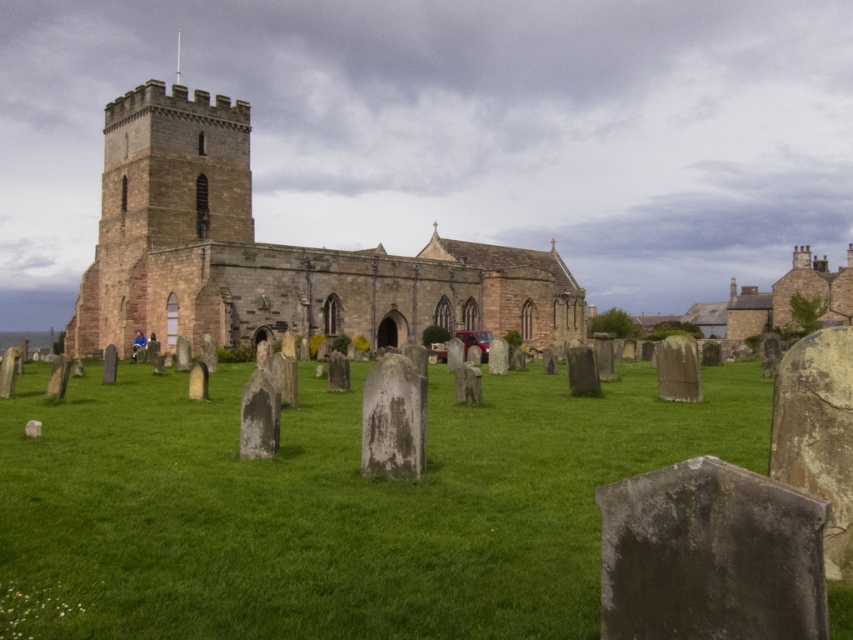
You are a visitor standing in the graveyard and want to take a photo of the brown stone church at center. Since you have a wide angle lens, you want to include as much of the green grassy at center as possible in the frame. Which object should you position closer to the camera to achieve this?

To include more of the green grassy at center in the photo while capturing the brown stone church at center, position the green grassy at center closer to the camera. Since the green grassy at center is smaller in size compared to the brown stone church at center, placing it nearer will make it appear larger in the frame, allowing both elements to be prominently featured.